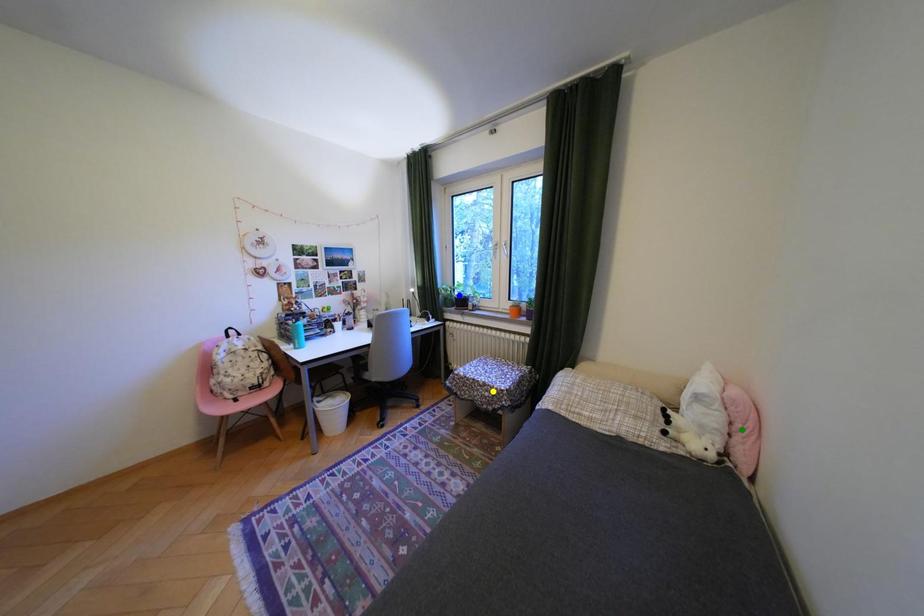
Order these from nearest to farthest:
1. blue point
2. yellow point
3. green point

green point, yellow point, blue point